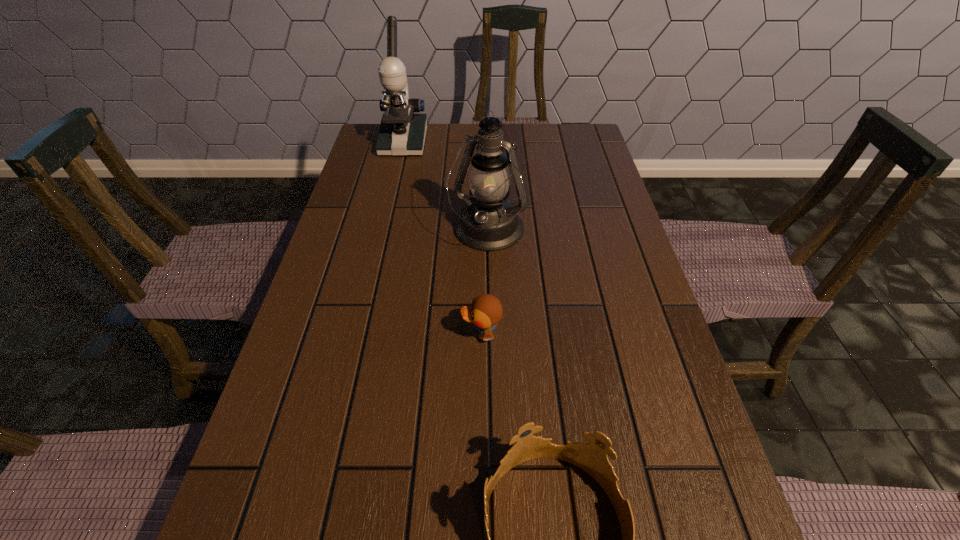
The width and height of the screenshot is (960, 540). In order to click on object positioned at the far edge in this screenshot , I will do `click(401, 133)`.

Locate an element on the screen. object situated at the left edge is located at coordinates (401, 133).

Where is `object that is at the far left corner`? object that is at the far left corner is located at coordinates (401, 133).

The height and width of the screenshot is (540, 960). What are the coordinates of `vacant space at the far edge of the desktop` in the screenshot? It's located at (436, 136).

Locate an element on the screen. The height and width of the screenshot is (540, 960). vacant space at the left edge is located at coordinates (369, 328).

This screenshot has width=960, height=540. I want to click on free location at the right edge, so click(618, 208).

You are a GUI agent. You are given a task and a screenshot of the screen. Output one action in this format:
    pyautogui.click(x=<x>, y=<y>)
    Task: Click on the vacant area at the far left corner
    This screenshot has width=960, height=540.
    Given the screenshot: What is the action you would take?
    pyautogui.click(x=371, y=127)

What are the coordinates of `unoccupied area between the oil lamp and the second nearest object` in the screenshot? It's located at (484, 283).

Find the location of a particular element. Image resolution: width=960 pixels, height=540 pixels. unoccupied area between the second nearest object and the leftmost object is located at coordinates (443, 238).

Find the location of a particular element. vacant space in between the oil lamp and the microscope is located at coordinates (445, 187).